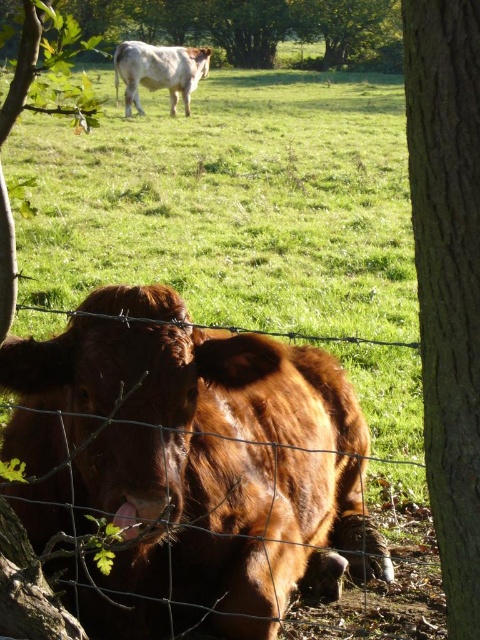
You are standing in the field and want to place a small flag at the closer point between point [368,108] and point [357,58]. Which point should you choose?

Point [368,108] is closer to the viewer than point [357,58], so you should choose point [368,108] to place the flag.

You are a farmer checking the field. You see the shiny brown bull at lower left and the brown furry cow at lower left. Which one is smaller in size?

The shiny brown bull at lower left is smaller in size compared to the brown furry cow at lower left.

You are a farmer standing in the field and want to approach the shiny brown bull at lower left. Can you reach it within 5 feet without moving your position?

The shiny brown bull at lower left is 5.17 feet away from viewer, so you cannot reach it within 5 feet without moving your position.